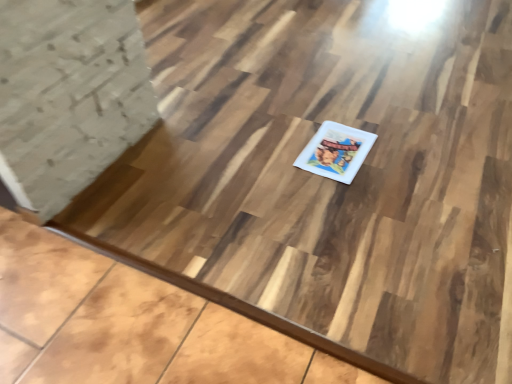
Locate an element on the screen. free space that is to the left of white glossy book at center is located at coordinates tap(272, 151).